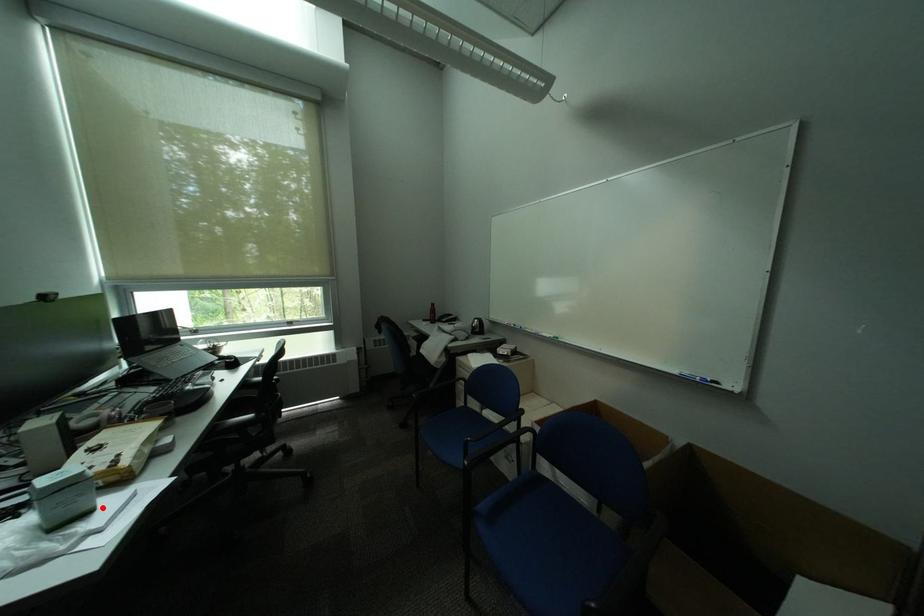
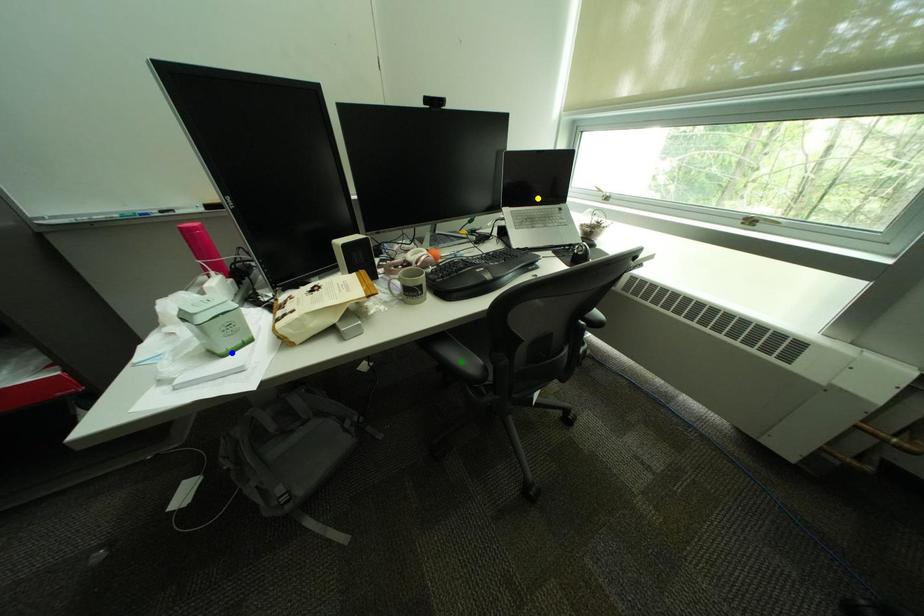
Question: I am providing you with two images of the same scene from different viewpoints. A red point is marked on the first image. You are given multiple points on the second image. In image 2, which mark is for the same physical point as the one in image 1?

Choices:
 (A) yellow point
 (B) green point
 (C) blue point

Answer: (C)